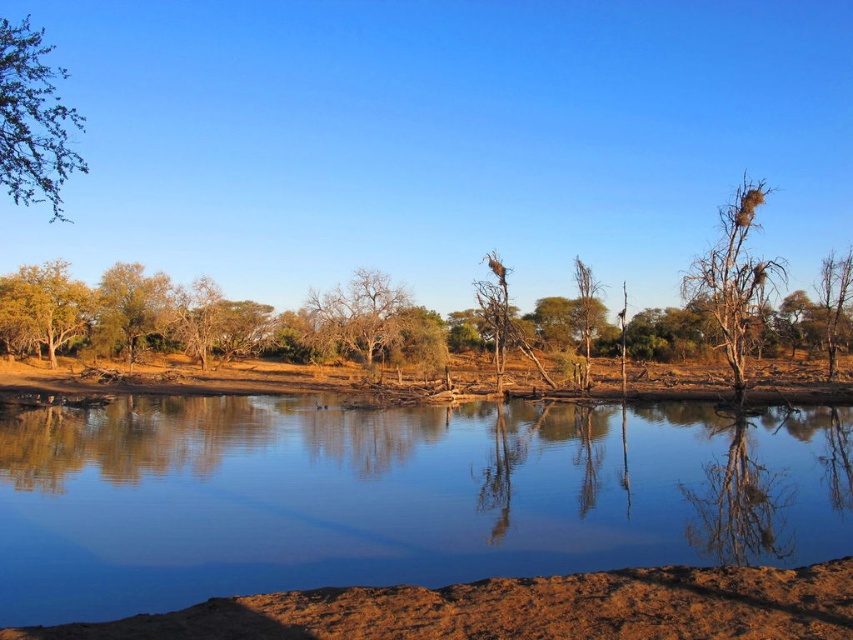
Question: Can you confirm if green leafy tree at upper left is smaller than yellow-green leafy tree at left?

Choices:
 (A) no
 (B) yes

Answer: (A)

Question: Among these points, which one is farthest from the camera?

Choices:
 (A) (16, 200)
 (B) (131, 332)
 (C) (721, 276)
 (D) (384, 328)

Answer: (A)

Question: Can you confirm if green leafy tree at upper left is thinner than brown dry tree at center?

Choices:
 (A) no
 (B) yes

Answer: (A)

Question: Considering the real-world distances, which object is closest to the transparent water at center?

Choices:
 (A) yellow-green leafy tree at left
 (B) brown dry tree at center
 (C) green leafy tree at left
 (D) brown dry branches at right

Answer: (D)

Question: Where is brown dry branches at right located in relation to brown dry tree at center in the image?

Choices:
 (A) below
 (B) above

Answer: (B)

Question: Estimate the real-world distances between objects in this image. Which object is closer to the green leafy tree at left?

Choices:
 (A) transparent water at center
 (B) green leafy tree at upper left
 (C) brown dry branches at right

Answer: (B)